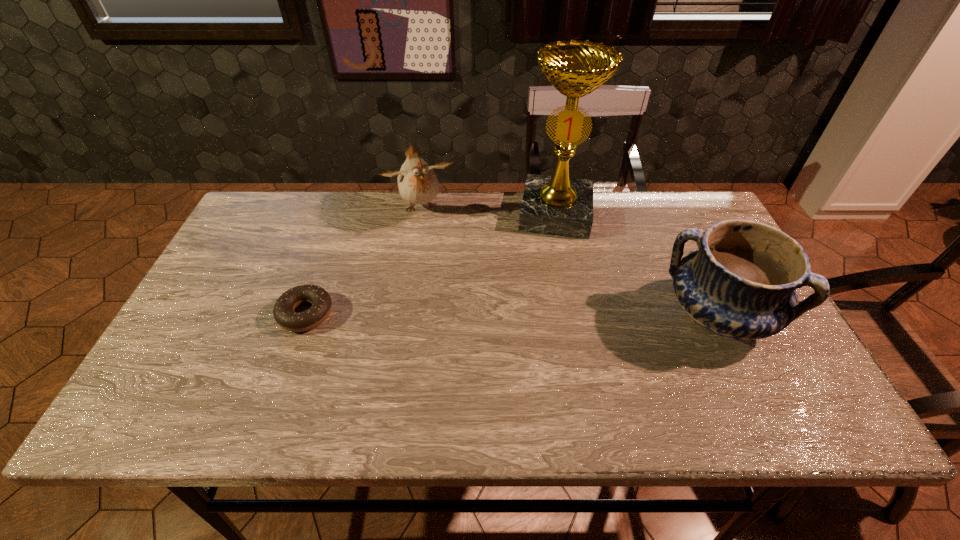
This screenshot has width=960, height=540. Identify the location of doughnut. (283, 312).

I want to click on the shortest object, so click(283, 312).

Find the location of `the rightmost object`. the rightmost object is located at coordinates (741, 282).

The width and height of the screenshot is (960, 540). What are the coordinates of `award` in the screenshot? It's located at (558, 205).

Locate an element on the screen. the third object from left to right is located at coordinates (558, 205).

Find the location of a particular element. The width and height of the screenshot is (960, 540). bird is located at coordinates (417, 182).

Locate an element on the screen. vacant region located 0.320m on the back of the doughnut is located at coordinates (340, 217).

In order to click on free spot located on the left of the pottery in this screenshot , I will do tap(637, 315).

Locate an element on the screen. free space located on the front-facing side of the tallest object is located at coordinates (548, 288).

Where is `blank space located on the front-facing side of the tallest object`? blank space located on the front-facing side of the tallest object is located at coordinates (551, 260).